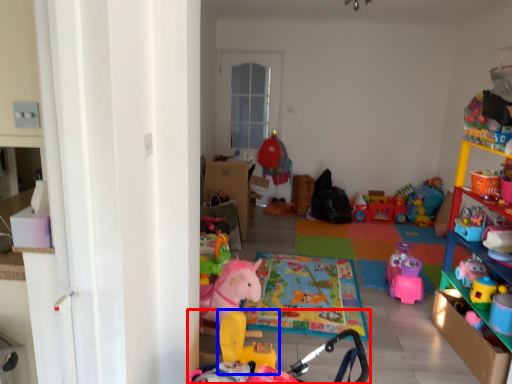
Question: Which of the following is the closest to the observer, toy (highlighted by a red box) or toy (highlighted by a blue box)?

Choices:
 (A) toy
 (B) toy

Answer: (A)